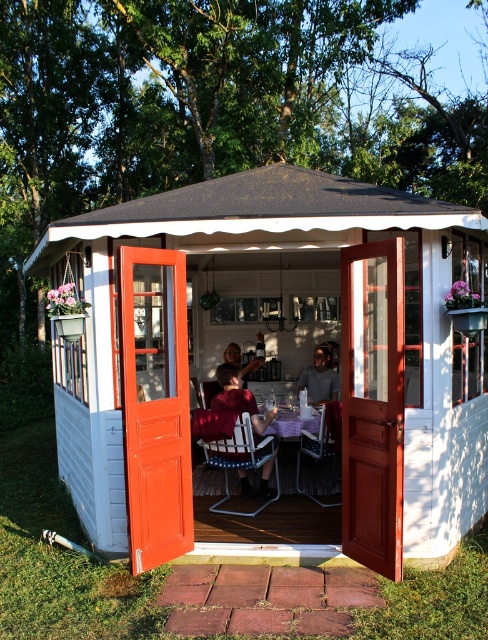
Question: Does matte red shirt at center have a smaller size compared to matte black shirt at center?

Choices:
 (A) yes
 (B) no

Answer: (A)

Question: Can you confirm if purple fabric picnic table at center is wider than gray cotton shirt at center?

Choices:
 (A) yes
 (B) no

Answer: (A)

Question: Among these objects, which one is farthest from the camera?

Choices:
 (A) matte red shirt at center
 (B) gray cotton shirt at center
 (C) purple fabric picnic table at center

Answer: (B)

Question: Estimate the real-world distances between objects in this image. Which object is farther from the gray cotton shirt at center?

Choices:
 (A) purple fabric picnic table at center
 (B) white wood gazebo at center
 (C) matte black shirt at center

Answer: (B)

Question: Observing the image, what is the correct spatial positioning of white wood gazebo at center in reference to matte black shirt at center?

Choices:
 (A) above
 (B) below

Answer: (A)

Question: Which object appears closest to the camera in this image?

Choices:
 (A) gray cotton shirt at center
 (B) matte red shirt at center
 (C) matte black shirt at center

Answer: (B)